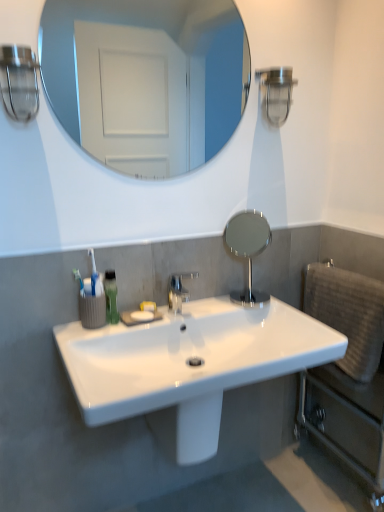
Question: Considering the relative sizes of white glossy sink at center and polished chrome faucet at center in the image provided, is white glossy sink at center taller than polished chrome faucet at center?

Choices:
 (A) yes
 (B) no

Answer: (B)

Question: Is white glossy sink at center at the right side of polished chrome faucet at center?

Choices:
 (A) no
 (B) yes

Answer: (B)

Question: Is white glossy sink at center not close to polished chrome faucet at center?

Choices:
 (A) yes
 (B) no

Answer: (B)

Question: From the image's perspective, is white glossy sink at center on polished chrome faucet at center?

Choices:
 (A) yes
 (B) no

Answer: (B)

Question: Is white glossy sink at center shorter than polished chrome faucet at center?

Choices:
 (A) no
 (B) yes

Answer: (B)

Question: Does point (145, 36) appear closer or farther from the camera than point (230, 230)?

Choices:
 (A) closer
 (B) farther

Answer: (B)

Question: Is clear glass mirror at upper center, the 2th mirror in the bottom-to-top sequence, to the left or to the right of polished silver mirror at center, the 1th mirror from the bottom, in the image?

Choices:
 (A) left
 (B) right

Answer: (A)

Question: Relative to polished silver mirror at center, which is the 2th mirror from top to bottom, is clear glass mirror at upper center, arranged as the 1th mirror when viewed from the left, in front or behind?

Choices:
 (A) behind
 (B) front

Answer: (B)

Question: Which is correct: clear glass mirror at upper center, the 2th mirror in the bottom-to-top sequence, is inside polished silver mirror at center, the second mirror viewed from the left, or outside of it?

Choices:
 (A) outside
 (B) inside

Answer: (A)

Question: Is clear glass mirror at upper center, the 1th mirror positioned from the top, to the left or to the right of green matte mouthwash at lower left in the image?

Choices:
 (A) left
 (B) right

Answer: (B)

Question: Looking at their shapes, would you say clear glass mirror at upper center, arranged as the 1th mirror when viewed from the left, is wider or thinner than green matte mouthwash at lower left?

Choices:
 (A) wide
 (B) thin

Answer: (B)

Question: From a real-world perspective, relative to green matte mouthwash at lower left, is clear glass mirror at upper center, the 1th mirror positioned from the top, vertically above or below?

Choices:
 (A) above
 (B) below

Answer: (A)

Question: Considering their positions, is clear glass mirror at upper center, arranged as the 1th mirror when viewed from the left, located in front of or behind green matte mouthwash at lower left?

Choices:
 (A) front
 (B) behind

Answer: (A)

Question: Considering the positions of polished chrome faucet at center and white glossy sink at center in the image, is polished chrome faucet at center bigger or smaller than white glossy sink at center?

Choices:
 (A) small
 (B) big

Answer: (A)

Question: Based on their positions, is polished chrome faucet at center located to the left or right of white glossy sink at center?

Choices:
 (A) left
 (B) right

Answer: (A)